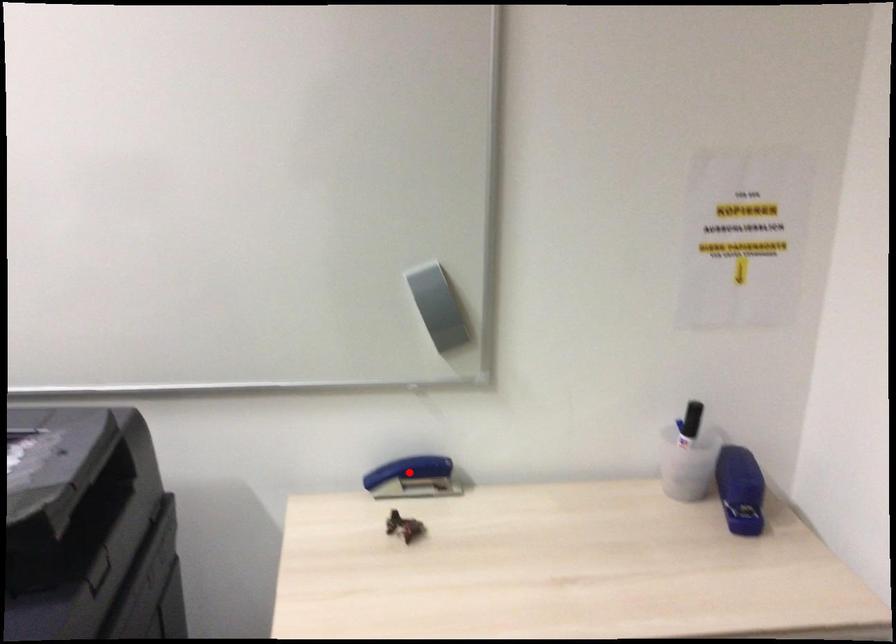
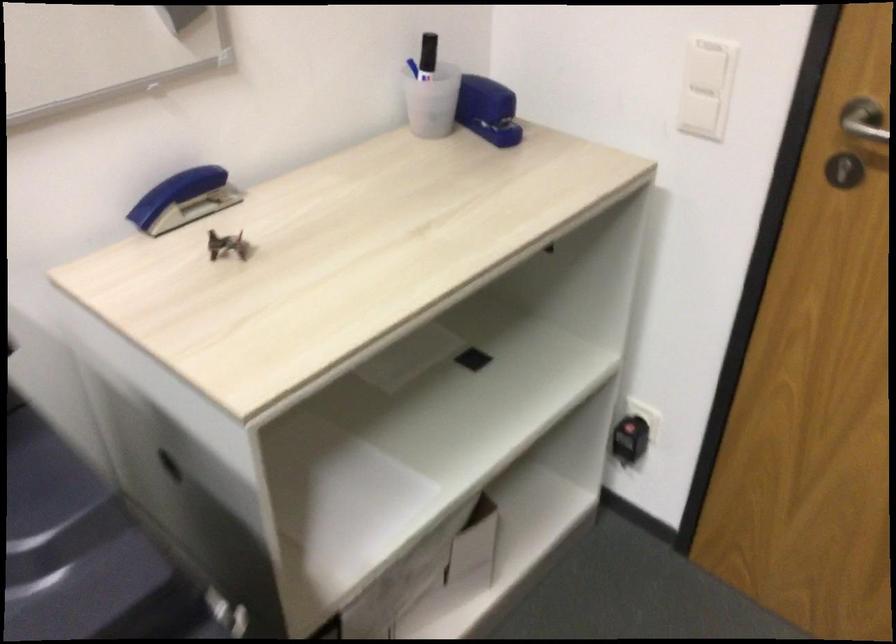
Question: I am providing you with two images of the same scene from different viewpoints. A red point is shown in image1. For the corresponding object point in image2, is it positioned nearer or farther from the camera?

Choices:
 (A) Nearer
 (B) Farther

Answer: (A)